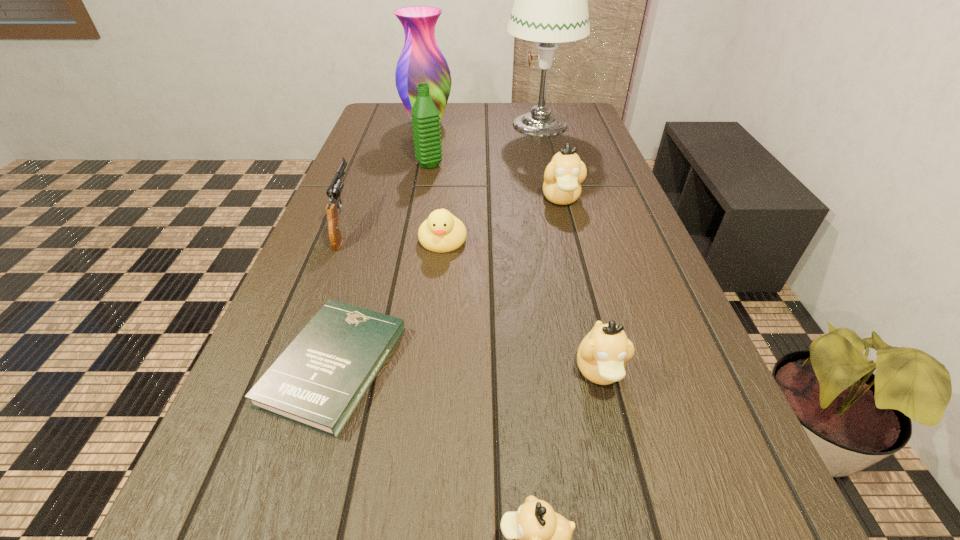
Find the location of a particular element. The height and width of the screenshot is (540, 960). the third nearest duckling is located at coordinates (442, 232).

This screenshot has width=960, height=540. Find the location of `yellow duckling`. yellow duckling is located at coordinates (442, 232).

You are a GUI agent. You are given a task and a screenshot of the screen. Output one action in this format:
    pyautogui.click(x=<x>, y=<y>)
    Task: Click on the shortest object
    The image size is (960, 540).
    Given the screenshot: What is the action you would take?
    pyautogui.click(x=318, y=381)

This screenshot has height=540, width=960. I want to click on dark book, so click(318, 381).

The image size is (960, 540). What are the coordinates of `free spot located 0.100m on the lampshade of the lampshade` in the screenshot? It's located at (474, 124).

Image resolution: width=960 pixels, height=540 pixels. Find the location of `vacant area located 0.320m on the lampshade of the lampshade`. vacant area located 0.320m on the lampshade of the lampshade is located at coordinates (409, 124).

What are the coordinates of `vacant space located 0.050m on the lampshade of the lampshade` in the screenshot? It's located at (489, 124).

This screenshot has width=960, height=540. I want to click on vacant space positioned on the right of the second tallest object, so click(539, 124).

This screenshot has width=960, height=540. What are the coordinates of `free space located on the back of the seventh shortest object` in the screenshot? It's located at click(438, 120).

The image size is (960, 540). I want to click on vacant space located on the face of the biggest tan duckling, so click(x=588, y=300).